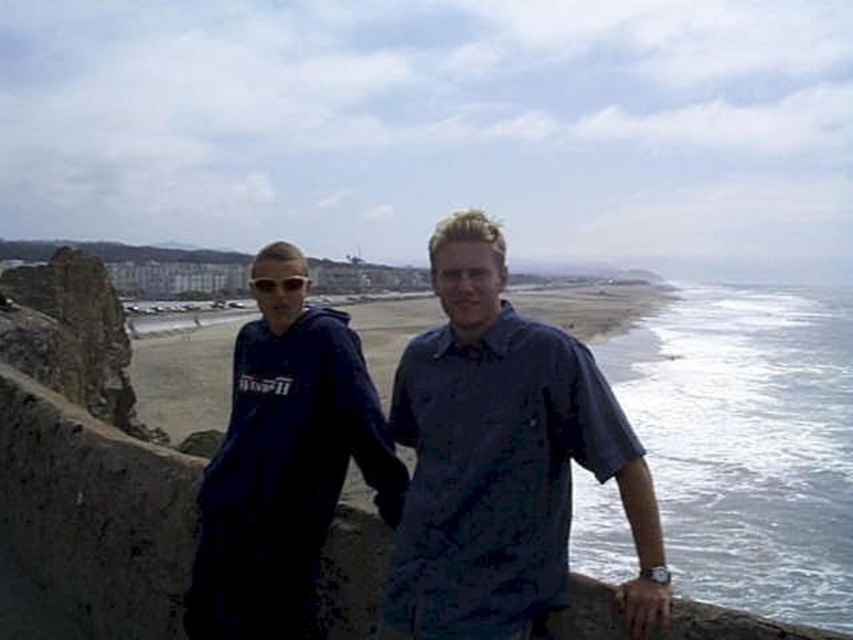
Question: From the image, what is the correct spatial relationship of blue fabric shirt at center in relation to matte blue hoodie at left?

Choices:
 (A) right
 (B) left

Answer: (A)

Question: Which of the following is the farthest from the observer?

Choices:
 (A) matte blue hoodie at left
 (B) blue fabric shirt at center

Answer: (A)

Question: Does blue fabric shirt at center have a greater width compared to matte blue hoodie at left?

Choices:
 (A) yes
 (B) no

Answer: (B)

Question: Is the position of blue fabric shirt at center more distant than that of matte blue hoodie at left?

Choices:
 (A) yes
 (B) no

Answer: (B)